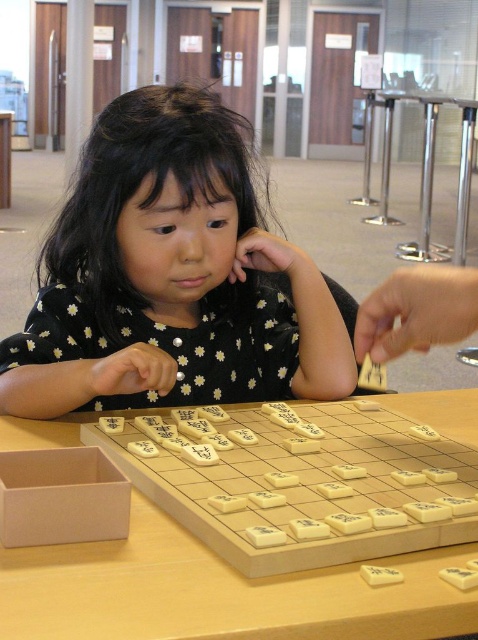
You are a photographer taking a picture of the scene described. You want to ensure both the black dotted dress at center and the wooden game board at center are clearly visible. Given their heights, which object might require you to adjust your camera angle to capture both effectively?

The black dotted dress at center is taller than the wooden game board at center. To capture both effectively, you might need to adjust your camera angle to account for the height difference between the two objects.

You are a photographer at the scene and want to capture the black dotted dress at center and the wooden game board at center in the same frame. Which object should you position closer to the camera to ensure both are in focus?

You should position the wooden game board at center closer to the camera because the black dotted dress at center is to the left of it, so adjusting the focus by moving the wooden game board at center forward will help both objects be in focus.